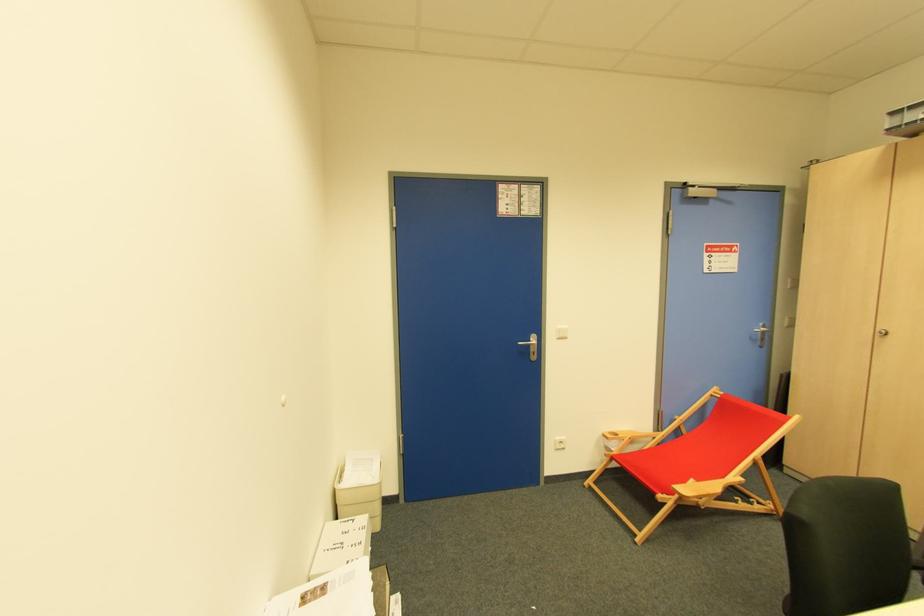
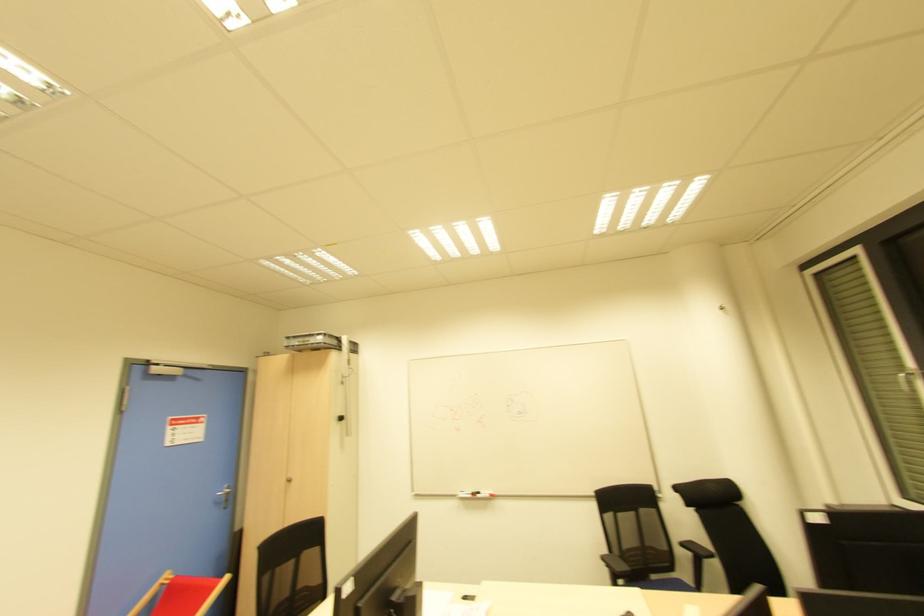
In the second image, find the point that corresponds to [762,341] in the first image.

(225, 501)